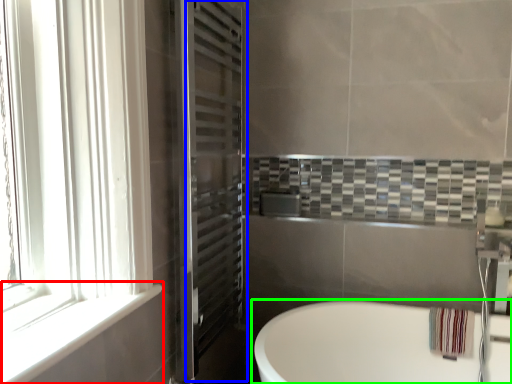
Question: Estimate the real-world distances between objects in this image. Which object is closer to window sill (highlighted by a red box), screen door (highlighted by a blue box) or bathtub (highlighted by a green box)?

Choices:
 (A) screen door
 (B) bathtub

Answer: (A)